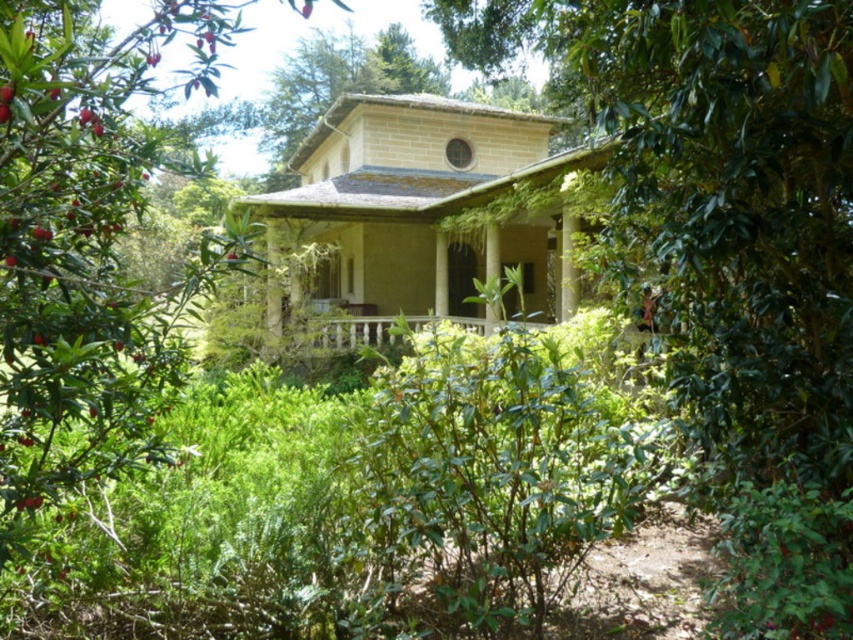
Question: Estimate the real-world distances between objects in this image. Which object is closer to the wooden porch at center?

Choices:
 (A) green leafy tree at center
 (B) green leafy bush at center

Answer: (A)

Question: Is green leafy bush at center positioned before wooden porch at center?

Choices:
 (A) yes
 (B) no

Answer: (A)

Question: Which of the following is the farthest from the observer?

Choices:
 (A) (793, 147)
 (B) (38, 472)

Answer: (B)

Question: Which object is the closest to the wooden porch at center?

Choices:
 (A) green leafy tree at center
 (B) green leafy bush at center

Answer: (A)

Question: Is green leafy tree at center above wooden porch at center?

Choices:
 (A) yes
 (B) no

Answer: (A)

Question: Does green leafy tree at center come in front of green leafy bush at center?

Choices:
 (A) no
 (B) yes

Answer: (A)